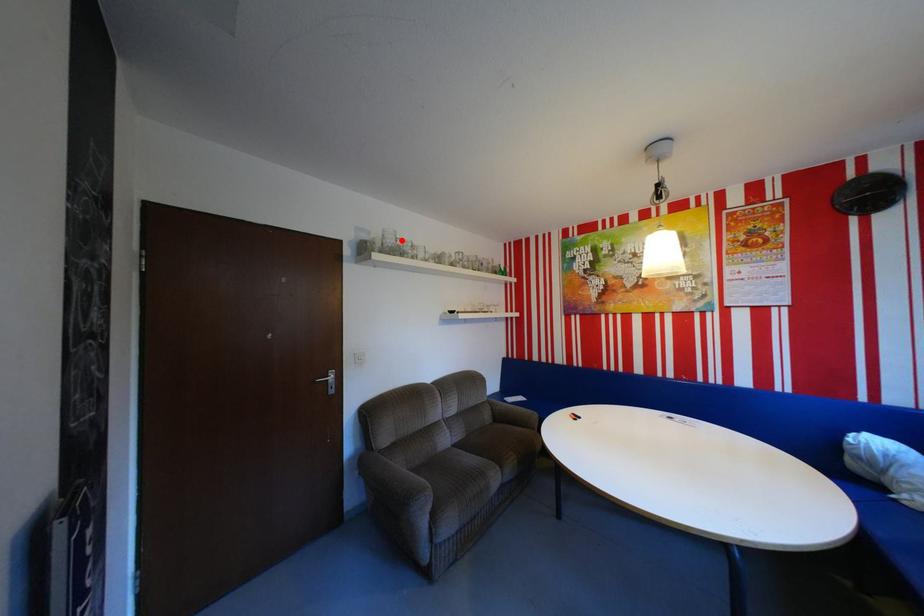
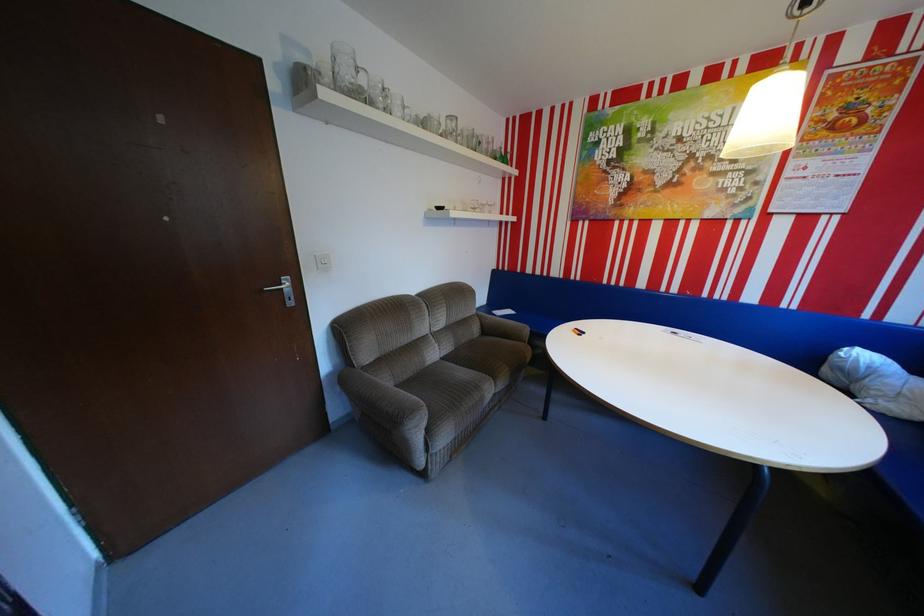
Locate, in the second image, the point that corresponds to the highlighted location in the first image.

(359, 73)